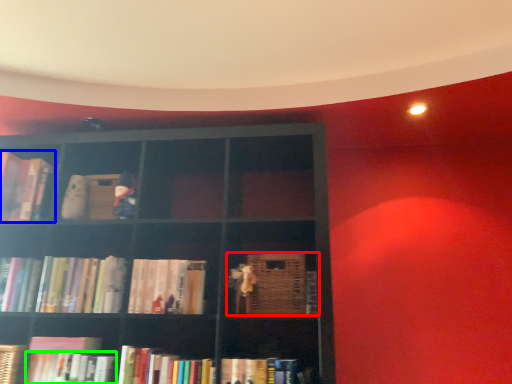
Question: Which object is positioned closest to book (highlighted by a red box)? Select from book (highlighted by a blue box) and book (highlighted by a green box).

Choices:
 (A) book
 (B) book

Answer: (B)